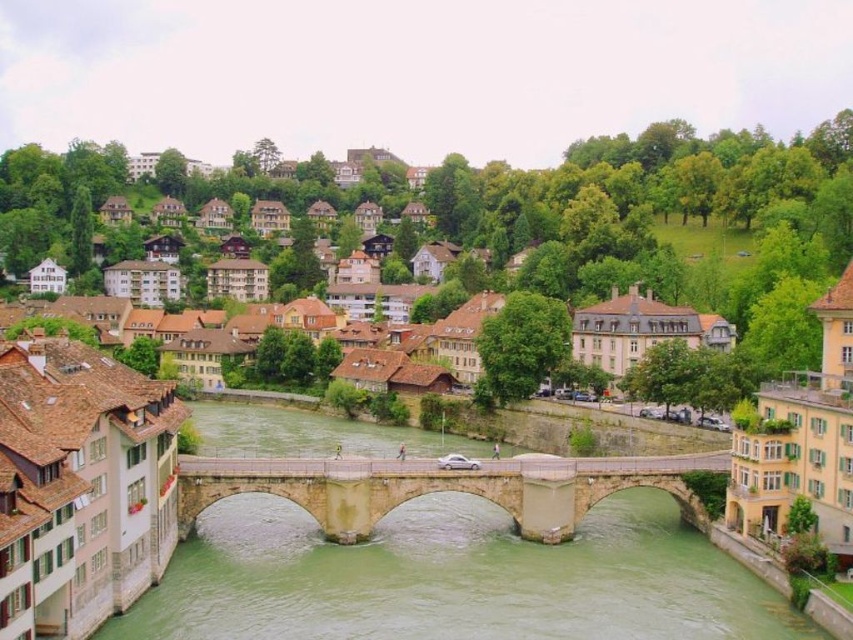
Between point (584, 557) and point (541, 538), which one is positioned in front?

Point (584, 557) is in front.

Is point (109, 627) closer to viewer compared to point (260, 472)?

Yes, it is.

Identify the location of green stone bridge at center. Image resolution: width=853 pixels, height=640 pixels. (456, 579).